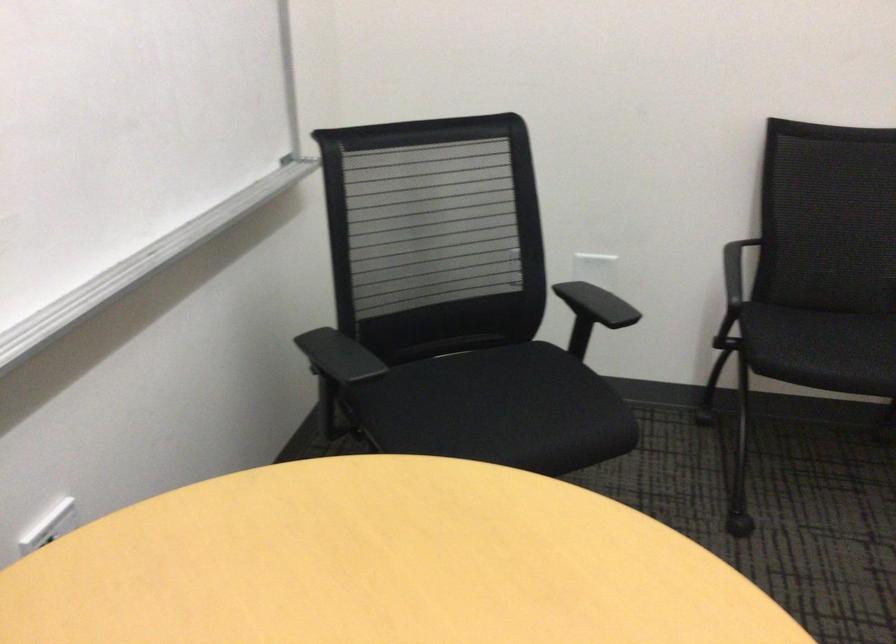
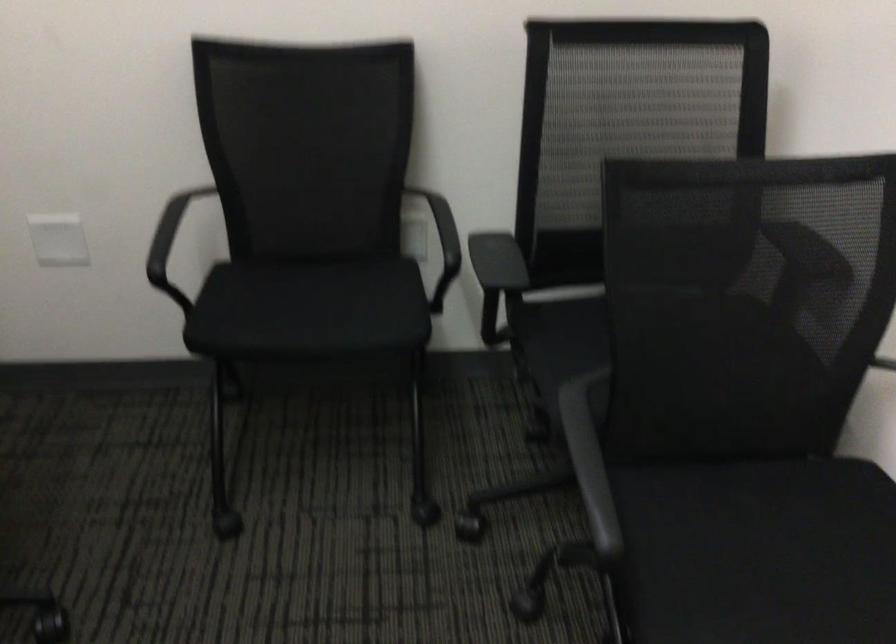
The images are taken continuously from a first-person perspective. In which direction are you moving?

The cameraman walked toward right, forward.